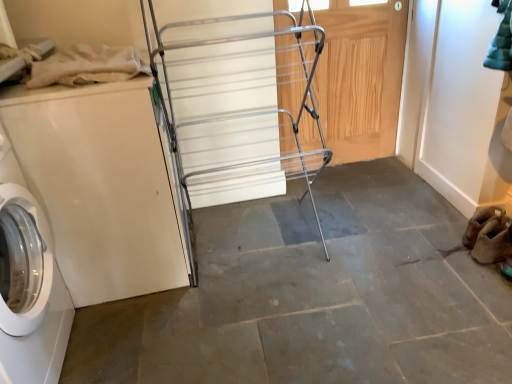
Question: Visually, is wooden door at center positioned to the left or to the right of silver metallic drying rack at center?

Choices:
 (A) right
 (B) left

Answer: (A)

Question: From the image's perspective, is wooden door at center located above or below silver metallic drying rack at center?

Choices:
 (A) above
 (B) below

Answer: (A)

Question: Which object is positioned farthest from the white glossy washing machine at left?

Choices:
 (A) wooden door at center
 (B) silver metallic drying rack at center

Answer: (A)

Question: Which of these objects is positioned closest to the white glossy washing machine at left?

Choices:
 (A) silver metallic drying rack at center
 (B) wooden door at center

Answer: (A)